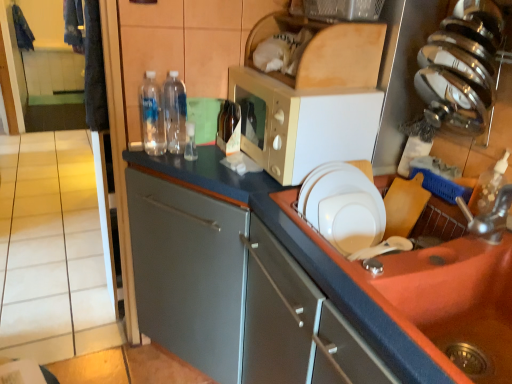
Where is `vacant area that is in front of transparent plastic bottle at center, the 2th bottle viewed from the right`? Image resolution: width=512 pixels, height=384 pixels. vacant area that is in front of transparent plastic bottle at center, the 2th bottle viewed from the right is located at coordinates (195, 166).